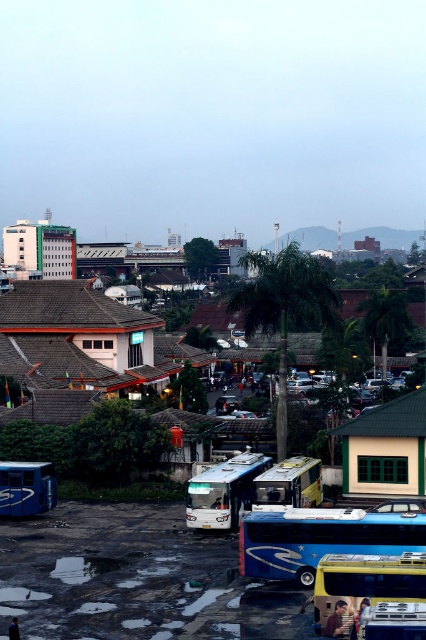
In the scene shown: Is blue metallic bus at lower center smaller than yellow metallic bus at lower right?

Yes.

Who is more forward, (x=371, y=547) or (x=420, y=595)?

Point (x=420, y=595)

Find the location of `blue metallic bus at lower center`. blue metallic bus at lower center is located at coordinates (321, 538).

Does beige matte building at center appear over metallic silver bus at center?

Indeed, beige matte building at center is positioned over metallic silver bus at center.

Can you confirm if beige matte building at center is positioned below metallic silver bus at center?

Incorrect, beige matte building at center is not positioned below metallic silver bus at center.

What do you see at coordinates (385, 448) in the screenshot?
I see `beige matte building at center` at bounding box center [385, 448].

You are a GUI agent. You are given a task and a screenshot of the screen. Output one action in this format:
    pyautogui.click(x=<x>, y=<y>)
    Task: Click on the beige matte building at center
    The width and height of the screenshot is (426, 640).
    Given the screenshot: What is the action you would take?
    pyautogui.click(x=385, y=448)

Is blue metallic bus at lower center below beige matte building at center?

Yes.

Which is more to the right, blue metallic bus at lower center or beige matte building at center?

From the viewer's perspective, beige matte building at center appears more on the right side.

Who is more distant from viewer, (x=342, y=515) or (x=405, y=436)?

Point (x=405, y=436)

This screenshot has width=426, height=640. In order to click on blue metallic bus at lower center in this screenshot , I will do `click(321, 538)`.